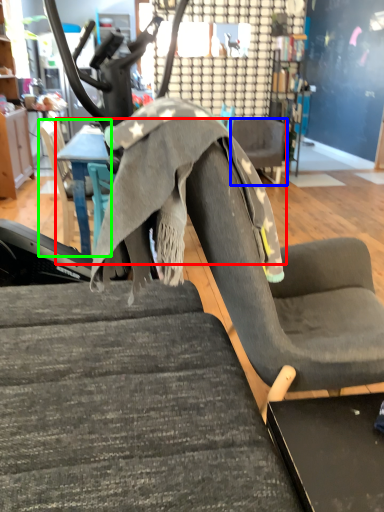
Question: Estimate the real-world distances between objects in this image. Which object is closer to table (highlighted by a red box), chair (highlighted by a blue box) or chair (highlighted by a green box)?

Choices:
 (A) chair
 (B) chair

Answer: (B)